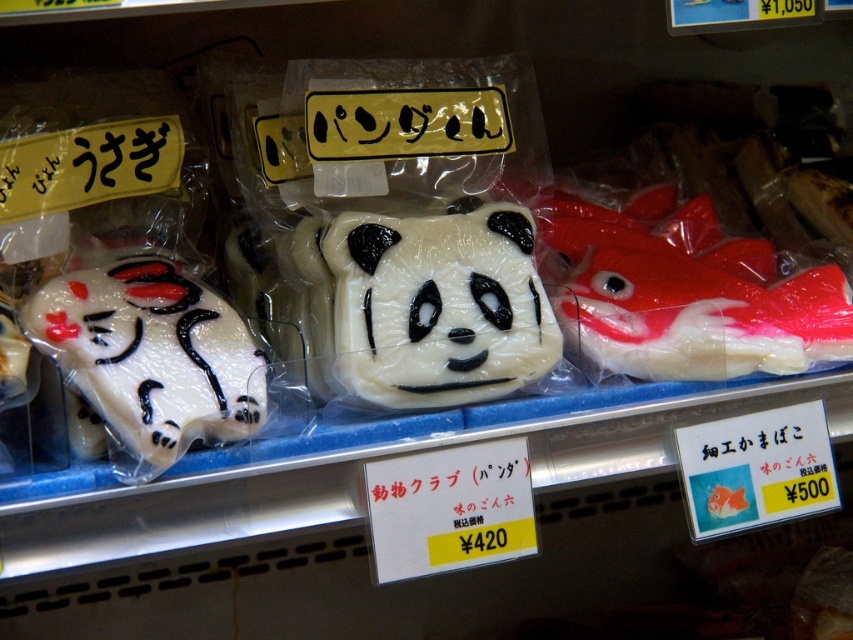
This screenshot has width=853, height=640. What do you see at coordinates (434, 305) in the screenshot?
I see `white matte/paper-like panda at center` at bounding box center [434, 305].

From the picture: Who is shorter, white matte/paper-like panda at center or white glossy cat at left?

With less height is white glossy cat at left.

Is point (387, 252) farther from viewer compared to point (131, 330)?

Yes.

The image size is (853, 640). I want to click on white matte/paper-like panda at center, so click(x=434, y=305).